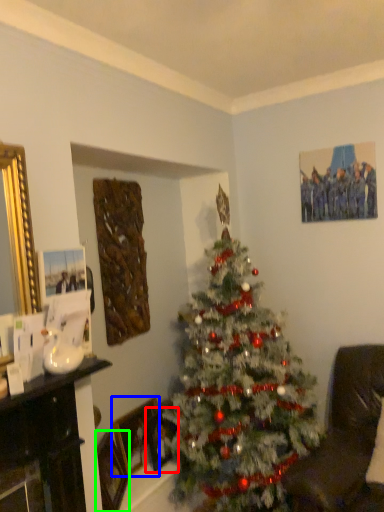
Question: Which object is the closest to the picture frame (highlighted by a red box)? Choose among these: picture frame (highlighted by a blue box) or picture frame (highlighted by a green box).

Choices:
 (A) picture frame
 (B) picture frame

Answer: (A)